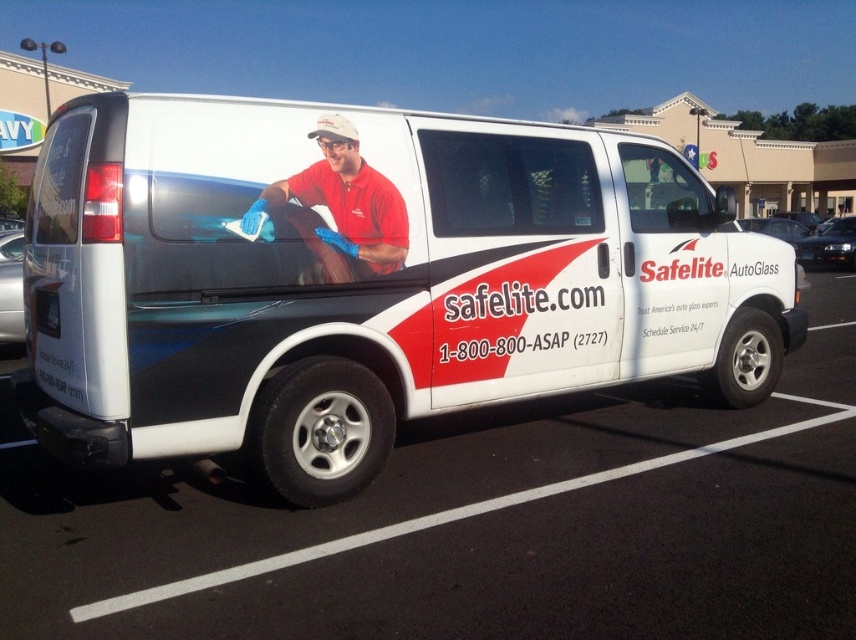
Question: Is white glossy van at center positioned at the back of matte red shirt at center?

Choices:
 (A) no
 (B) yes

Answer: (B)

Question: Which point is farther to the camera?

Choices:
 (A) white matte van at center
 (B) matte red shirt at center
 (C) white glossy van at center

Answer: (A)

Question: Which is farther from the white glossy van at center?

Choices:
 (A) matte red shirt at center
 (B) white matte van at center

Answer: (B)

Question: Considering the relative positions of white matte van at center and white glossy van at center in the image provided, where is white matte van at center located with respect to white glossy van at center?

Choices:
 (A) left
 (B) right

Answer: (B)

Question: Is white matte van at center to the right of matte red shirt at center from the viewer's perspective?

Choices:
 (A) yes
 (B) no

Answer: (A)

Question: Which point appears closest to the camera in this image?

Choices:
 (A) (758, 529)
 (B) (134, 284)
 (C) (354, 195)

Answer: (B)